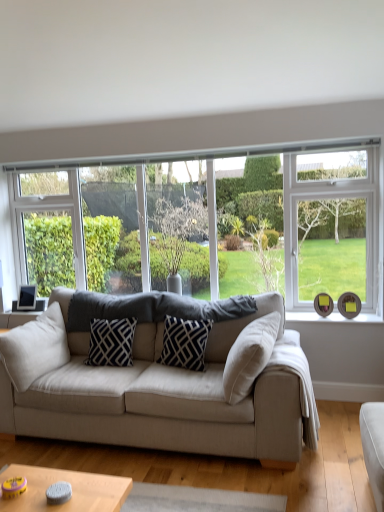
Image resolution: width=384 pixels, height=512 pixels. In order to click on free spot above black and white patterned pillow at center, arranged as the second pillow when viewed from the right (from a real-world perspective) in this screenshot , I will do `click(109, 320)`.